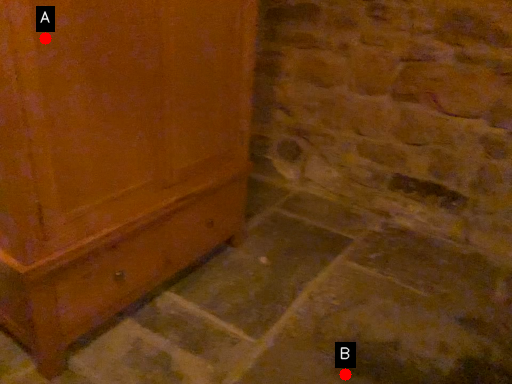
Question: Two points are circled on the image, labeled by A and B beside each circle. Which point is farther to the camera?

Choices:
 (A) A is further
 (B) B is further

Answer: (B)